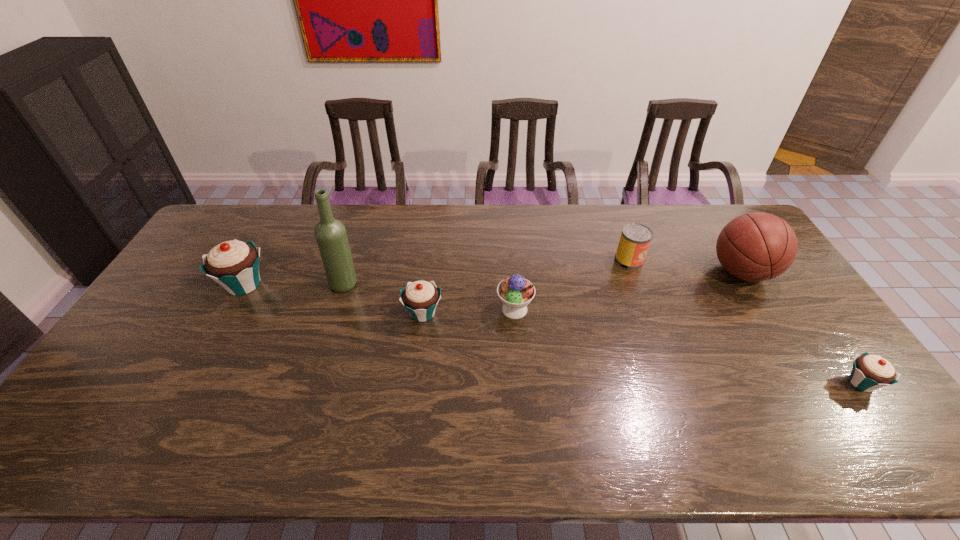
The height and width of the screenshot is (540, 960). I want to click on the leftmost cupcake, so click(x=234, y=264).

This screenshot has width=960, height=540. What are the coordinates of `the fifth shortest object` in the screenshot? It's located at (234, 264).

Where is `the second cupcake from left to right`? the second cupcake from left to right is located at coordinates (420, 298).

Image resolution: width=960 pixels, height=540 pixels. Find the location of `the third object from left to right`. the third object from left to right is located at coordinates (420, 298).

This screenshot has width=960, height=540. Find the location of `the shortest object`. the shortest object is located at coordinates (870, 372).

Image resolution: width=960 pixels, height=540 pixels. I want to click on the nearest cupcake, so click(870, 372).

At what (x,y) coordinates should I click in order to perform the action: click on the third object from right to left. Please return your answer as a coordinate pair (x, y). The image size is (960, 540). Looking at the image, I should click on (635, 239).

Where is `the second tallest object`? the second tallest object is located at coordinates (758, 246).

Find the location of `wine bottle`. wine bottle is located at coordinates (330, 233).

Where is `the sixth object from right to left`? the sixth object from right to left is located at coordinates (330, 233).